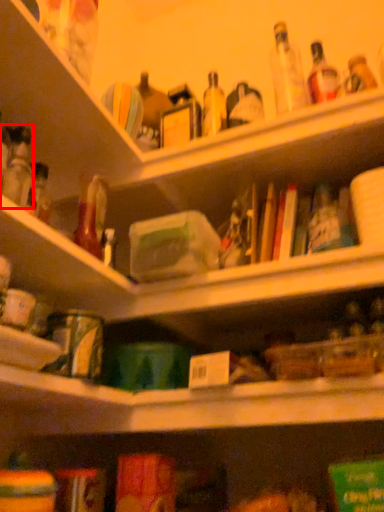
Question: From the image's perspective, considering the relative positions of bottle (annotated by the red box) and shelf in the image provided, where is bottle (annotated by the red box) located with respect to the staircase?

Choices:
 (A) below
 (B) above

Answer: (A)